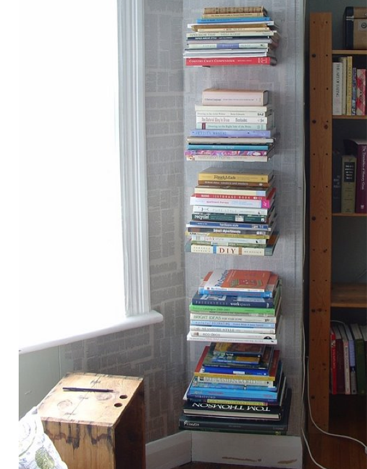
The width and height of the screenshot is (367, 469). What are the coordinates of `window` in the screenshot? It's located at (78, 229).